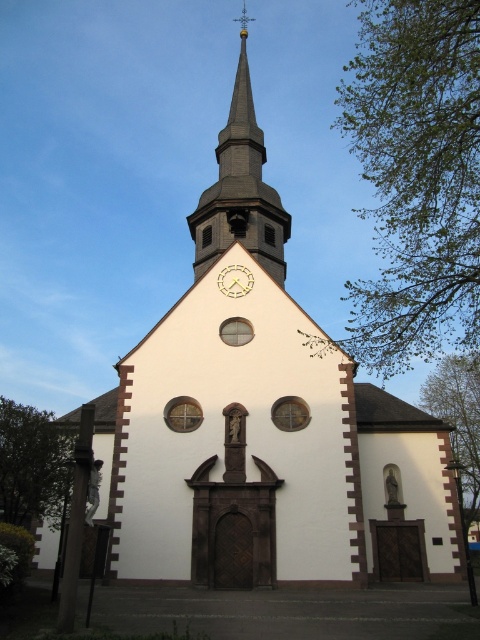
Question: Which object is farther from the camera taking this photo?

Choices:
 (A) gold metallic clock at center
 (B) smooth gray steeple at upper center

Answer: (B)

Question: Considering the relative positions of smooth gray steeple at upper center and gold metallic clock at center in the image provided, where is smooth gray steeple at upper center located with respect to gold metallic clock at center?

Choices:
 (A) left
 (B) right

Answer: (A)

Question: Is smooth gray steeple at upper center closer to camera compared to gold metallic clock at center?

Choices:
 (A) yes
 (B) no

Answer: (B)

Question: Which point appears farthest from the camera in this image?

Choices:
 (A) (251, 284)
 (B) (257, 161)

Answer: (B)

Question: Is smooth gray steeple at upper center further to camera compared to gold metallic clock at center?

Choices:
 (A) no
 (B) yes

Answer: (B)